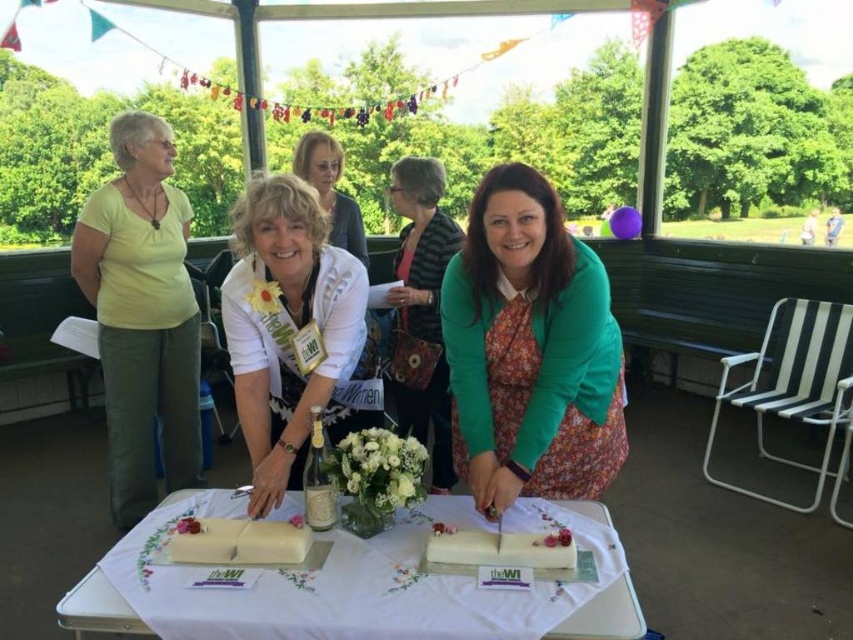
Question: Can you confirm if green fabric dress at center is positioned below white matte cake at lower center?

Choices:
 (A) no
 (B) yes

Answer: (A)

Question: Is white satin dress at center smaller than white cream cake at center?

Choices:
 (A) yes
 (B) no

Answer: (B)

Question: Which point is closer to the camera?

Choices:
 (A) (177, 212)
 (B) (279, 440)
 (C) (354, 216)
 (D) (431, 240)

Answer: (B)

Question: Does white satin dress at center appear on the right side of white fabric tablecloth at center?

Choices:
 (A) yes
 (B) no

Answer: (B)

Question: Which object is closer to the camera taking this photo?

Choices:
 (A) green fabric dress at center
 (B) white matte cake at lower center
 (C) white fabric tablecloth at center

Answer: (C)

Question: Which of the following is the closest to the observer?

Choices:
 (A) (410, 243)
 (B) (250, 380)

Answer: (B)